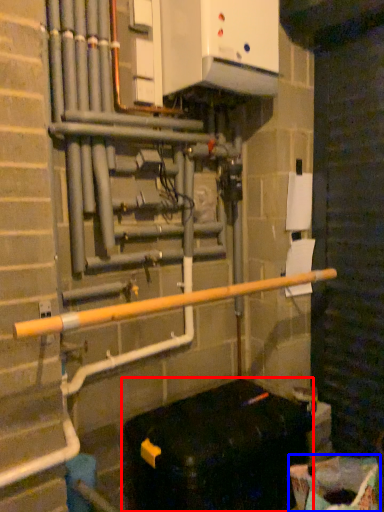
Question: Which point is closer to the camera, furniture (highlighted by a red box) or recycling bin (highlighted by a blue box)?

Choices:
 (A) furniture
 (B) recycling bin

Answer: (B)